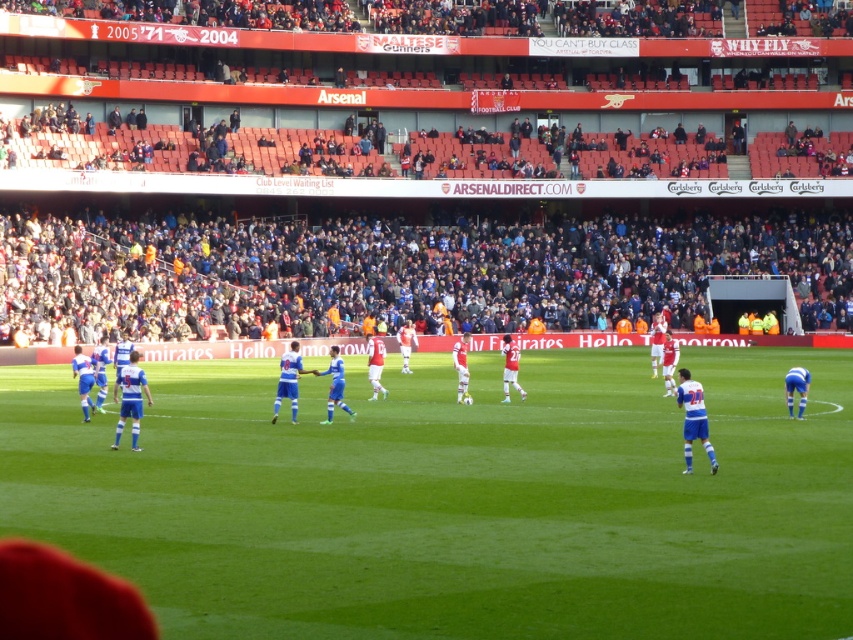
Is dark blue jersey at center further to the viewer compared to blue jersey at center?

That is True.

Is dark blue jersey at center closer to the viewer compared to blue jersey at center?

No, dark blue jersey at center is further to the viewer.

Which is behind, point (300, 273) or point (444, 355)?

Positioned behind is point (300, 273).

The height and width of the screenshot is (640, 853). In order to click on dark blue jersey at center in this screenshot , I will do `click(404, 272)`.

Is green grass football field at center above blue jersey at center?

No, green grass football field at center is not above blue jersey at center.

At what (x,y) coordinates should I click in order to perform the action: click on green grass football field at center. Please return your answer as a coordinate pair (x, y). This screenshot has height=640, width=853. Looking at the image, I should click on (453, 499).

Is point (614, 605) closer to viewer compared to point (756, 336)?

That is True.

Image resolution: width=853 pixels, height=640 pixels. I want to click on green grass football field at center, so click(x=453, y=499).

Is point (477, 492) positioned behind point (271, 256)?

No, (477, 492) is closer to viewer.

Who is positioned more to the left, green grass football field at center or dark blue jersey at center?

Positioned to the left is green grass football field at center.

Find the location of a particular element. green grass football field at center is located at coordinates (453, 499).